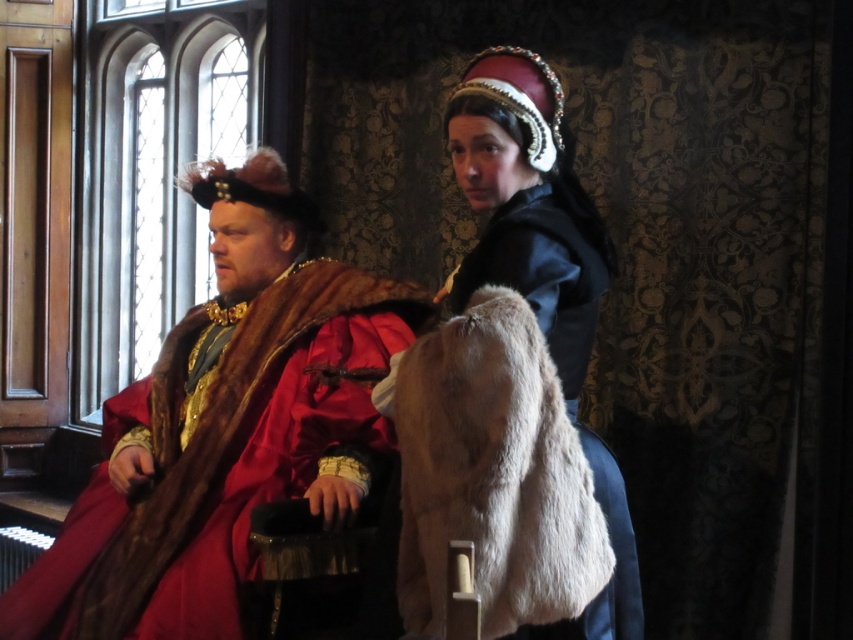
Question: Which point is closer to the camera taking this photo?

Choices:
 (A) tap(143, 593)
 (B) tap(572, 172)

Answer: (B)

Question: Which point appears closest to the camera in this image?

Choices:
 (A) (569, 378)
 (B) (244, 340)

Answer: (A)

Question: Does velvet red robe at left lie behind velvet black dress at center?

Choices:
 (A) yes
 (B) no

Answer: (A)

Question: Considering the relative positions of velvet red robe at left and velvet black dress at center in the image provided, where is velvet red robe at left located with respect to velvet black dress at center?

Choices:
 (A) left
 (B) right

Answer: (A)

Question: Does velvet red robe at left come behind velvet black dress at center?

Choices:
 (A) yes
 (B) no

Answer: (A)

Question: Which object appears farthest from the camera in this image?

Choices:
 (A) velvet black dress at center
 (B) velvet red robe at left

Answer: (B)